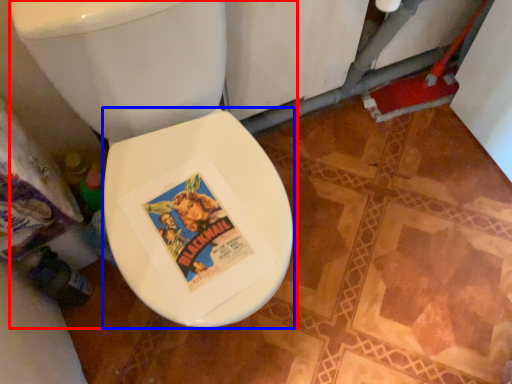
Question: Which object is further to the camera taking this photo, toilet (highlighted by a red box) or bidet (highlighted by a blue box)?

Choices:
 (A) toilet
 (B) bidet

Answer: (B)